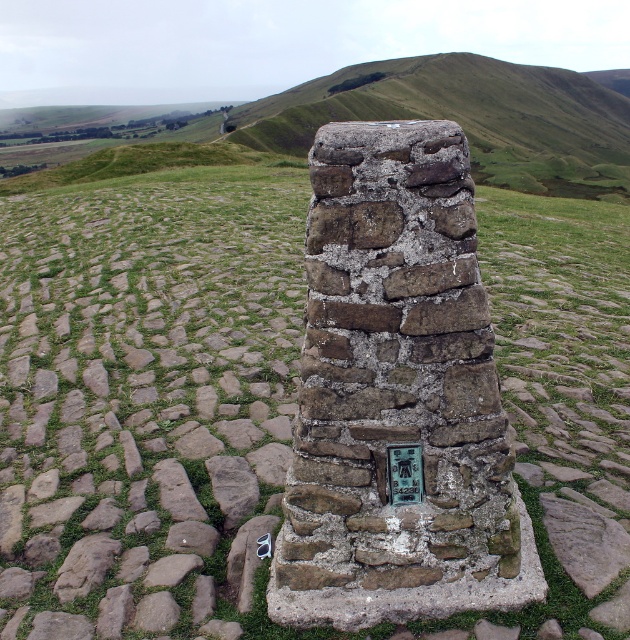
Does point (316, 292) lie in front of point (266, 547)?

Yes, point (316, 292) is closer to viewer.

Is weathered stone marker at center taller than metallic gray sunglasses at center?

Indeed, weathered stone marker at center has a greater height compared to metallic gray sunglasses at center.

What are the coordinates of `weathered stone marker at center` in the screenshot? It's located at (396, 396).

What do you see at coordinates (471, 116) in the screenshot? This screenshot has width=630, height=640. I see `rustic stone cairn at center` at bounding box center [471, 116].

Who is shorter, rustic stone cairn at center or metallic gray sunglasses at center?

metallic gray sunglasses at center is shorter.

Who is more forward, (491, 177) or (258, 540)?

Point (258, 540)

Where is `rustic stone cairn at center`? rustic stone cairn at center is located at coordinates (471, 116).

Which is behind, point (392, 234) or point (401, 481)?

Positioned behind is point (401, 481).

Does point (459, 371) come farther from viewer compared to point (401, 468)?

No, it is not.

Locate an element on the screen. This screenshot has width=630, height=640. weathered stone marker at center is located at coordinates (396, 396).